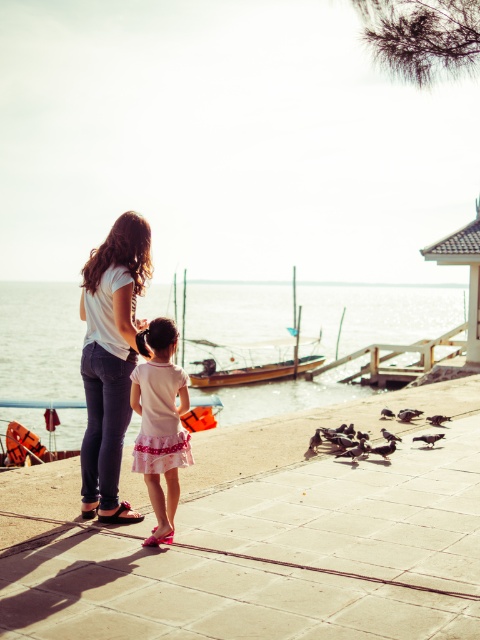
Is wooden boat at center smaller than orange fabric sandal at lower left?

Actually, wooden boat at center might be larger than orange fabric sandal at lower left.

Which is in front, point (290, 368) or point (96, 508)?

Point (96, 508) is in front.

Locate an element on the screen. This screenshot has height=640, width=480. wooden boat at center is located at coordinates (252, 371).

Which is in front, point (112, 508) or point (235, 374)?

Positioned in front is point (112, 508).

Which is more to the left, matte white shirt at center or wooden boat at center?

matte white shirt at center is more to the left.

The width and height of the screenshot is (480, 640). In order to click on matte white shirt at center in this screenshot , I will do `click(109, 353)`.

Which is more to the right, smooth concrete dock at center or pink fabric sandal at lower center?

smooth concrete dock at center

Does smooth concrete dock at center appear on the right side of pink fabric sandal at lower center?

Indeed, smooth concrete dock at center is positioned on the right side of pink fabric sandal at lower center.

At what (x,y) coordinates should I click in order to perform the action: click on smooth concrete dock at center. Please return your answer as a coordinate pair (x, y). The width and height of the screenshot is (480, 640). Looking at the image, I should click on (345, 492).

This screenshot has height=640, width=480. What are the coordinates of `smooth concrete dock at center` in the screenshot? It's located at (345, 492).